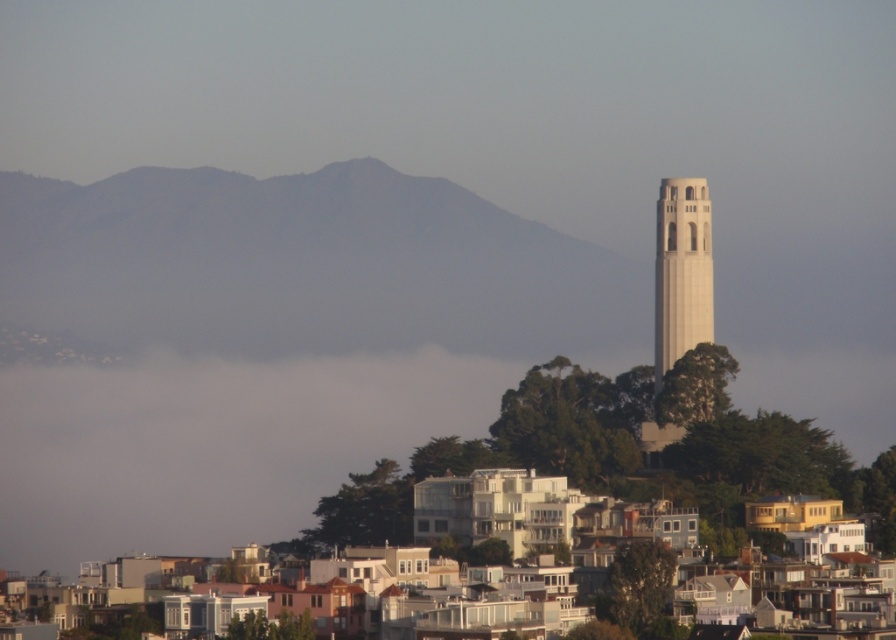
Can you confirm if gray rocky mountain at upper center is bigger than white concrete tower at center-right?

Correct, gray rocky mountain at upper center is larger in size than white concrete tower at center-right.

Is gray rocky mountain at upper center shorter than white concrete tower at center-right?

Yes, gray rocky mountain at upper center is shorter than white concrete tower at center-right.

Who is more distant from viewer, (533, 314) or (687, 336)?

The point (687, 336) is more distant.

Where is `gray rocky mountain at upper center`? The image size is (896, 640). gray rocky mountain at upper center is located at coordinates (306, 266).